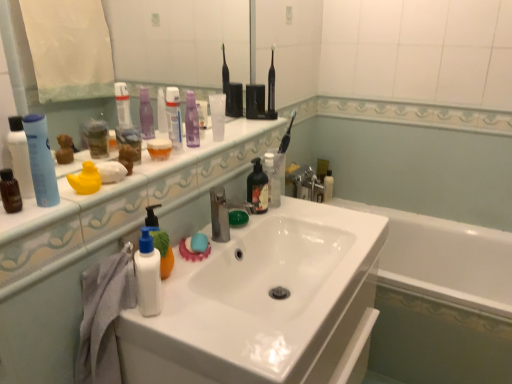
This screenshot has height=384, width=512. I want to click on vacant area to the right of translucent plastic mouthwash at right, the first mouthwash from the right, so click(352, 203).